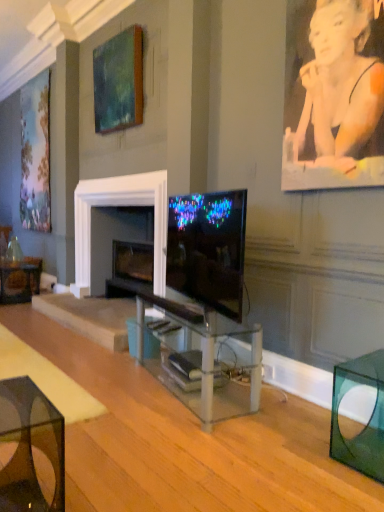
Find the location of a particular element. The height and width of the screenshot is (512, 384). blue plastic trash bin at center is located at coordinates (150, 342).

What do you see at coordinates (157, 324) in the screenshot? I see `black plastic remote control at center, the first remote control from the back` at bounding box center [157, 324].

Locate an element on the screen. Image resolution: width=384 pixels, height=512 pixels. black plastic remote control at center, positioned as the first remote control in front-to-back order is located at coordinates (168, 329).

You are a GUI agent. You are given a task and a screenshot of the screen. Output one action in this format:
    pyautogui.click(x=<x>, y=<y>)
    Task: Click on the matte black tv at center
    The image size is (384, 512).
    Given the screenshot: What is the action you would take?
    pyautogui.click(x=208, y=249)

What's the angular difference between pastel floral fabric at left, the 1th picture frame in the back-to-front sequence, and smooth skin portrait at upper right's facing directions?

They differ by 0.854 degrees in their facing directions.

Is pastel floral fabric at left, positioned as the 2th picture frame in front-to-back order, positioned in front of smooth skin portrait at upper right?

No, pastel floral fabric at left, positioned as the 2th picture frame in front-to-back order, is further to the viewer.

From the image's perspective, is pastel floral fabric at left, the second picture frame in the right-to-left sequence, above or below smooth skin portrait at upper right?

pastel floral fabric at left, the second picture frame in the right-to-left sequence, is above smooth skin portrait at upper right.

Is pastel floral fabric at left, the 1th picture frame in the back-to-front sequence, shorter than smooth skin portrait at upper right?

No, pastel floral fabric at left, the 1th picture frame in the back-to-front sequence, is not shorter than smooth skin portrait at upper right.

From the image's perspective, is black plastic remote control at center, the first remote control from the back, located above transparent glass table at center, acting as the 3th table starting from the left?

Correct, black plastic remote control at center, the first remote control from the back, appears higher than transparent glass table at center, acting as the 3th table starting from the left, in the image.

Could you tell me if black plastic remote control at center, the 2th remote control viewed from the front, is facing transparent glass table at center, positioned as the 3th table in front-to-back order?

Yes, black plastic remote control at center, the 2th remote control viewed from the front, is oriented towards transparent glass table at center, positioned as the 3th table in front-to-back order.

In the scene shown: How distant is black plastic remote control at center, the 2th remote control viewed from the front, from transparent glass table at center, positioned as the 3th table in front-to-back order?

black plastic remote control at center, the 2th remote control viewed from the front, and transparent glass table at center, positioned as the 3th table in front-to-back order, are 19.63 inches apart from each other.

Locate an element on the screen. The height and width of the screenshot is (512, 384). table behind the black plastic remote control at center, the first remote control from the back is located at coordinates (19, 280).

How much distance is there between black plastic remote control at center, the first remote control from the back, and translucent glass table at lower left, the first table from the left?

They are 2.70 meters apart.

From the image's perspective, which is below, black plastic remote control at center, the 2th remote control viewed from the front, or translucent glass table at lower left, which ranks as the 1th table in back-to-front order?

black plastic remote control at center, the 2th remote control viewed from the front.

What's the angular difference between black plastic remote control at center, the 2th remote control viewed from the front, and translucent glass table at lower left, arranged as the 4th table when viewed from the right,'s facing directions?

There is a 78.2-degree angle between the facing directions of black plastic remote control at center, the 2th remote control viewed from the front, and translucent glass table at lower left, arranged as the 4th table when viewed from the right.

How different are the orientations of teal matte painting at upper center, the 2th picture frame positioned from the back, and smooth skin portrait at upper right in degrees?

The facing directions of teal matte painting at upper center, the 2th picture frame positioned from the back, and smooth skin portrait at upper right are 0.117 degrees apart.

Who is taller, teal matte painting at upper center, positioned as the 1th picture frame in front-to-back order, or smooth skin portrait at upper right?

smooth skin portrait at upper right is taller.

Is point (129, 116) closer or farther from the camera than point (348, 16)?

Point (129, 116).

Would you say black plastic remote control at center, the 2th remote control viewed from the front, is outside smooth skin portrait at upper right?

Yes, black plastic remote control at center, the 2th remote control viewed from the front, is located beyond the bounds of smooth skin portrait at upper right.

Is point (157, 321) closer to viewer compared to point (326, 145)?

No.

In the scene shown: Does black plastic remote control at center, the 2th remote control viewed from the front, have a greater height compared to smooth skin portrait at upper right?

In fact, black plastic remote control at center, the 2th remote control viewed from the front, may be shorter than smooth skin portrait at upper right.

Measure the distance from black plastic remote control at center, the 2th remote control viewed from the front, to smooth skin portrait at upper right.

Result: black plastic remote control at center, the 2th remote control viewed from the front, is 6.21 feet away from smooth skin portrait at upper right.

Is blue plastic trash bin at center taller or shorter than matte black tv at center?

blue plastic trash bin at center is shorter than matte black tv at center.

Which object is closer to the camera, blue plastic trash bin at center or matte black tv at center?

matte black tv at center is closer to the camera.

Is blue plastic trash bin at center in contact with matte black tv at center?

They are not placed beside each other.

Is there a large distance between black plastic remote control at center, which appears as the 2th remote control when viewed from the back, and blue plastic trash bin at center?

No, black plastic remote control at center, which appears as the 2th remote control when viewed from the back, is in close proximity to blue plastic trash bin at center.

Consider the image. Would you say black plastic remote control at center, positioned as the first remote control in front-to-back order, contains blue plastic trash bin at center?

No, blue plastic trash bin at center is not inside black plastic remote control at center, positioned as the first remote control in front-to-back order.

Looking at this image, considering the sizes of objects black plastic remote control at center, which appears as the 2th remote control when viewed from the back, and blue plastic trash bin at center in the image provided, who is thinner, black plastic remote control at center, which appears as the 2th remote control when viewed from the back, or blue plastic trash bin at center?

black plastic remote control at center, which appears as the 2th remote control when viewed from the back.

What are the coordinates of `the 2nd picture frame behind the smooth skin portrait at upper right, counting from the anchor's position` in the screenshot? It's located at (35, 154).

From a real-world perspective, which remote control is the 1st one above the transparent glass table at center, acting as the 3th table starting from the left? Please provide its 2D coordinates.

[(157, 324)]

Which object lies nearer to the anchor point teal matte painting at upper center, positioned as the 1th picture frame in front-to-back order, black plastic remote control at center, which appears as the 2th remote control when viewed from the back, or smooth skin portrait at upper right?

smooth skin portrait at upper right.

From the image, which object appears to be nearer to smooth skin portrait at upper right, blue plastic trash bin at center or translucent glass table at lower left, the 4th table from the front?

Among the two, blue plastic trash bin at center is located nearer to smooth skin portrait at upper right.

Considering their positions, is transparent glass table at center, placed as the 2th table when sorted from back to front, positioned closer to transparent glass table at lower left, arranged as the second table when viewed from the left, than transparent glass cube at lower right, the 1th table positioned from the right?

The object closer to transparent glass table at lower left, arranged as the second table when viewed from the left, is transparent glass table at center, placed as the 2th table when sorted from back to front.

Looking at the image, which one is located further to matte black tv at center, teal matte painting at upper center, arranged as the 2th picture frame when viewed from the left, or smooth skin portrait at upper right?

teal matte painting at upper center, arranged as the 2th picture frame when viewed from the left, lies further to matte black tv at center than the other object.

Considering their positions, is pastel floral fabric at left, the second picture frame in the right-to-left sequence, positioned closer to teal matte painting at upper center, arranged as the 2th picture frame when viewed from the left, than transparent glass cube at lower right, the 2th table in the front-to-back sequence?

The object closer to teal matte painting at upper center, arranged as the 2th picture frame when viewed from the left, is pastel floral fabric at left, the second picture frame in the right-to-left sequence.

When comparing their distances from translucent glass table at lower left, the first table from the left, does matte black tv at center or smooth skin portrait at upper right seem closer?

matte black tv at center is positioned closer to the anchor translucent glass table at lower left, the first table from the left.

When comparing their distances from transparent glass table at lower left, positioned as the 4th table in back-to-front order, does black plastic remote control at center, which appears as the 2th remote control when viewed from the back, or transparent glass cube at lower right, the third table from the back, seem closer?

Among the two, black plastic remote control at center, which appears as the 2th remote control when viewed from the back, is located nearer to transparent glass table at lower left, positioned as the 4th table in back-to-front order.

Which object lies nearer to the anchor point black plastic remote control at center, positioned as the first remote control in front-to-back order, translucent glass table at lower left, which ranks as the 1th table in back-to-front order, or transparent glass table at lower left, arranged as the second table when viewed from the left?

Among the two, transparent glass table at lower left, arranged as the second table when viewed from the left, is located nearer to black plastic remote control at center, positioned as the first remote control in front-to-back order.

Image resolution: width=384 pixels, height=512 pixels. Find the location of `television located between transparent glass table at lower left, arranged as the second table when viewed from the left, and translucent glass table at lower left, the first table from the left, in the depth direction`. television located between transparent glass table at lower left, arranged as the second table when viewed from the left, and translucent glass table at lower left, the first table from the left, in the depth direction is located at coordinates (208, 249).

The height and width of the screenshot is (512, 384). I want to click on television between transparent glass table at lower left, positioned as the third table in right-to-left order, and pastel floral fabric at left, placed as the 1th picture frame when sorted from left to right, from front to back, so click(x=208, y=249).

You are a GUI agent. You are given a task and a screenshot of the screen. Output one action in this format:
    pyautogui.click(x=<x>, y=<y>)
    Task: Click on the trash bin/can between transparent glass table at center, positioned as the 3th table in front-to-back order, and pastel floral fabric at left, the second picture frame in the right-to-left sequence, in the front-back direction
    
    Given the screenshot: What is the action you would take?
    pyautogui.click(x=150, y=342)

Locate an element on the screen. This screenshot has height=512, width=384. table between teal matte painting at upper center, arranged as the 1th picture frame when viewed from the right, and black plastic remote control at center, which appears as the 2th remote control when viewed from the back, in the up-down direction is located at coordinates (19, 280).